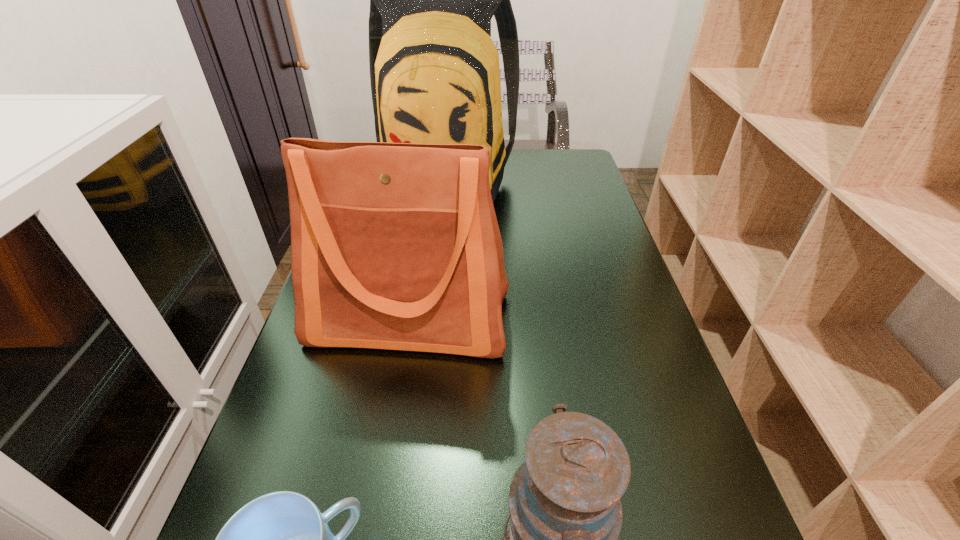
The height and width of the screenshot is (540, 960). Find the location of `backpack`. backpack is located at coordinates (434, 69).

Where is `the tallest object`? The height and width of the screenshot is (540, 960). the tallest object is located at coordinates (434, 69).

Identify the location of the third nearest object. This screenshot has height=540, width=960. (396, 246).

This screenshot has height=540, width=960. Identify the location of vacant point located 0.310m on the front-facing side of the tallest object. (431, 308).

The image size is (960, 540). I want to click on vacant region located on the right of the second farthest object, so click(x=555, y=320).

The image size is (960, 540). Find the location of `object at the far edge`. object at the far edge is located at coordinates (434, 69).

Identify the location of backpack present at the left edge. (434, 69).

Where is `shopping bag positioned at the left edge`? Image resolution: width=960 pixels, height=540 pixels. shopping bag positioned at the left edge is located at coordinates (396, 246).

Locate an element on the screen. object present at the far left corner is located at coordinates (434, 69).

Image resolution: width=960 pixels, height=540 pixels. I want to click on vacant area at the left edge of the desktop, so tap(370, 352).